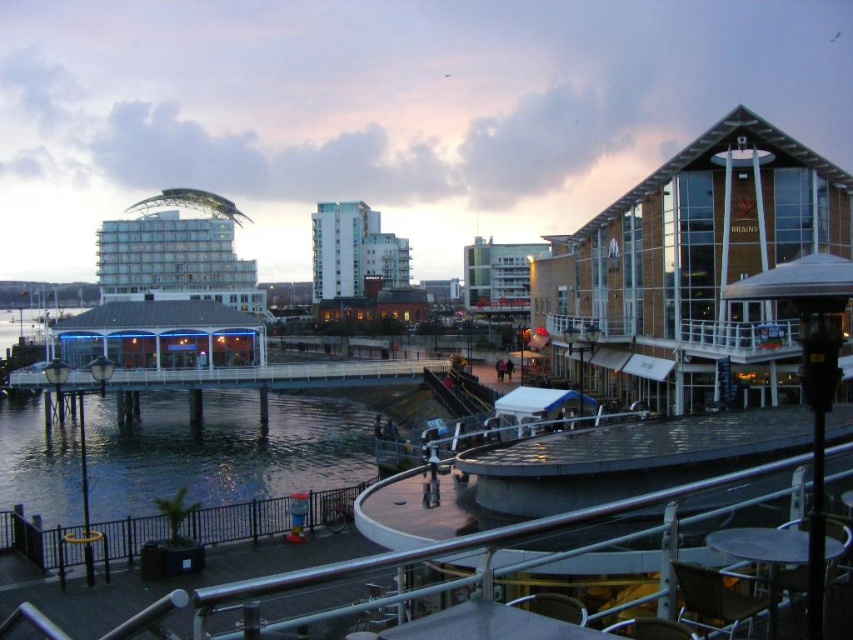
Question: From the image, what is the correct spatial relationship of clear water at lower left in relation to black metal railing at lower left?

Choices:
 (A) right
 (B) left

Answer: (B)

Question: Which point is farther from the camera taking this photo?

Choices:
 (A) (42, 536)
 (B) (88, 426)

Answer: (B)

Question: Does clear water at lower left appear under black metal railing at lower left?

Choices:
 (A) yes
 (B) no

Answer: (A)

Question: In this image, where is clear water at lower left located relative to black metal railing at lower left?

Choices:
 (A) left
 (B) right

Answer: (A)

Question: Which point appears closest to the camera in this image?

Choices:
 (A) (154, 480)
 (B) (112, 520)

Answer: (B)